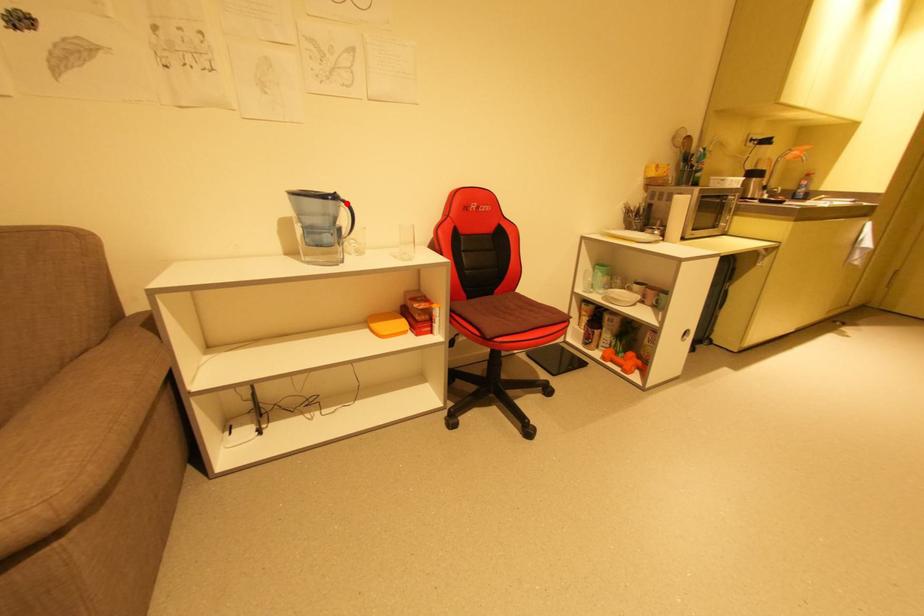
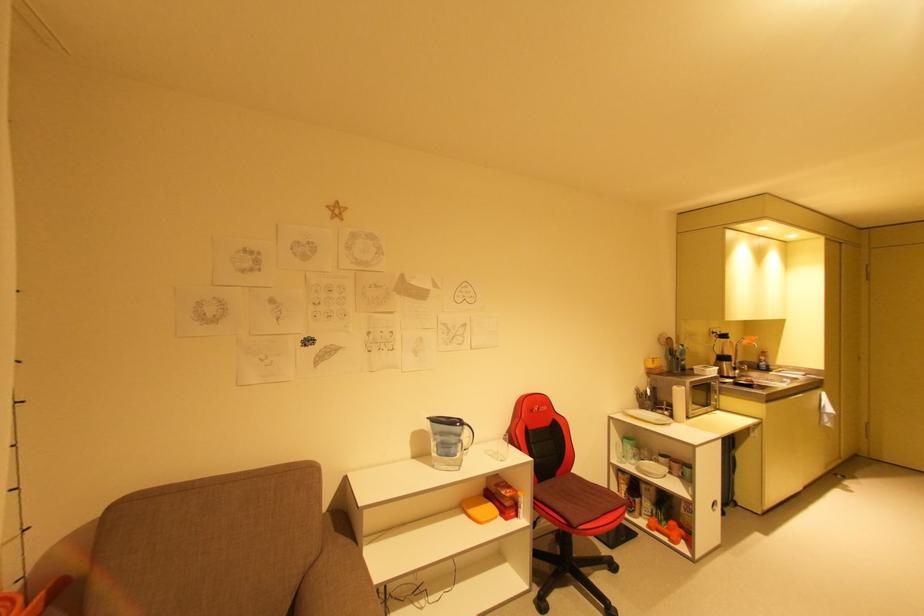
Where in the second image is the point corresponding to the highlighted location from the first image?

(469, 427)